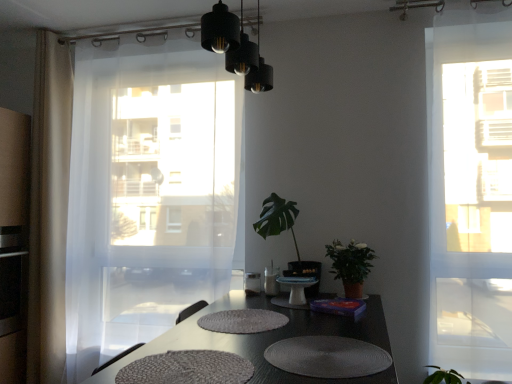
Question: Is the depth of transparent glass window at right greater than that of white glossy cake stand at center?

Choices:
 (A) no
 (B) yes

Answer: (A)

Question: From the image's perspective, is transparent glass window at right on white glossy cake stand at center?

Choices:
 (A) no
 (B) yes

Answer: (B)

Question: Is transparent glass window at right in front of white glossy cake stand at center?

Choices:
 (A) no
 (B) yes

Answer: (B)

Question: Is transparent glass window at right to the left of white glossy cake stand at center from the viewer's perspective?

Choices:
 (A) no
 (B) yes

Answer: (A)

Question: Does transparent glass window at right have a larger size compared to white glossy cake stand at center?

Choices:
 (A) no
 (B) yes

Answer: (B)

Question: Is white glossy cake stand at center surrounded by transparent glass window at right?

Choices:
 (A) yes
 (B) no

Answer: (B)

Question: Is white glossy cake stand at center not within white textured placemat at center?

Choices:
 (A) no
 (B) yes

Answer: (B)

Question: From the image's perspective, is white glossy cake stand at center located above white textured placemat at center?

Choices:
 (A) no
 (B) yes

Answer: (B)

Question: Does white glossy cake stand at center come behind white textured placemat at center?

Choices:
 (A) no
 (B) yes

Answer: (B)

Question: Is white glossy cake stand at center taller than white textured placemat at center?

Choices:
 (A) no
 (B) yes

Answer: (B)

Question: From the image's perspective, would you say white glossy cake stand at center is shown under white textured placemat at center?

Choices:
 (A) no
 (B) yes

Answer: (A)

Question: Does white glossy cake stand at center appear on the right side of white textured placemat at center?

Choices:
 (A) yes
 (B) no

Answer: (A)

Question: Is black matte light fixture at upper center positioned beyond the bounds of green matte plant at right, the first houseplant viewed from the right?

Choices:
 (A) no
 (B) yes

Answer: (B)